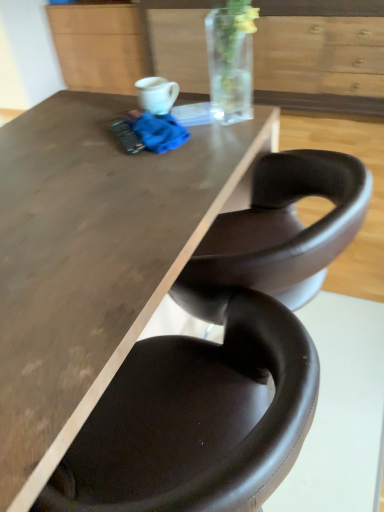
Identify the location of free space in front of white glossy mug at upper center. Image resolution: width=384 pixels, height=512 pixels. [165, 150].